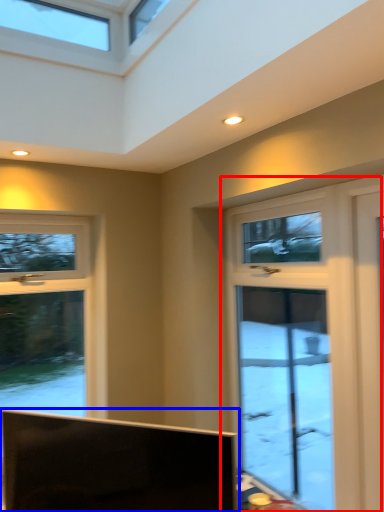
Question: Among these objects, which one is nearest to the camera, window (highlighted by a red box) or television (highlighted by a blue box)?

Choices:
 (A) window
 (B) television

Answer: (B)